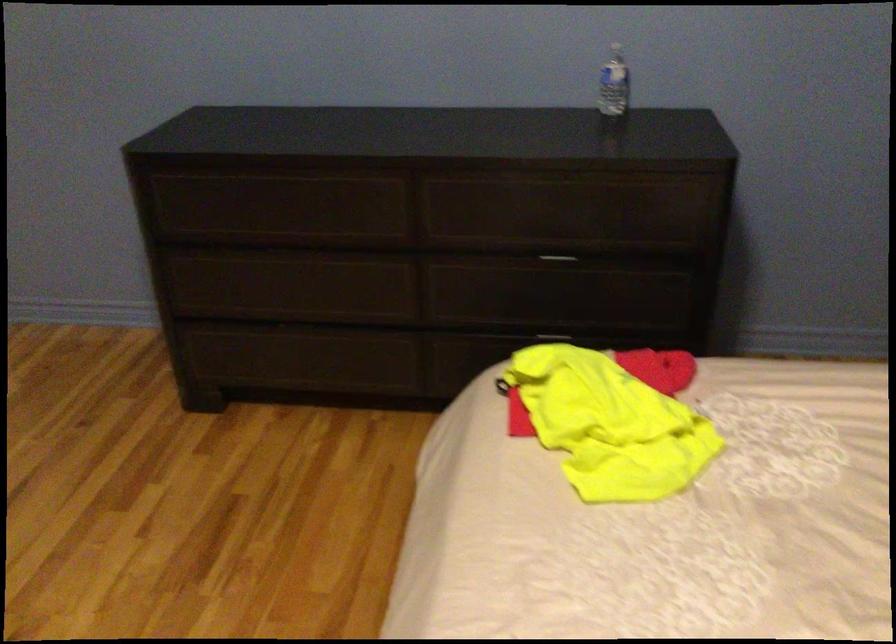
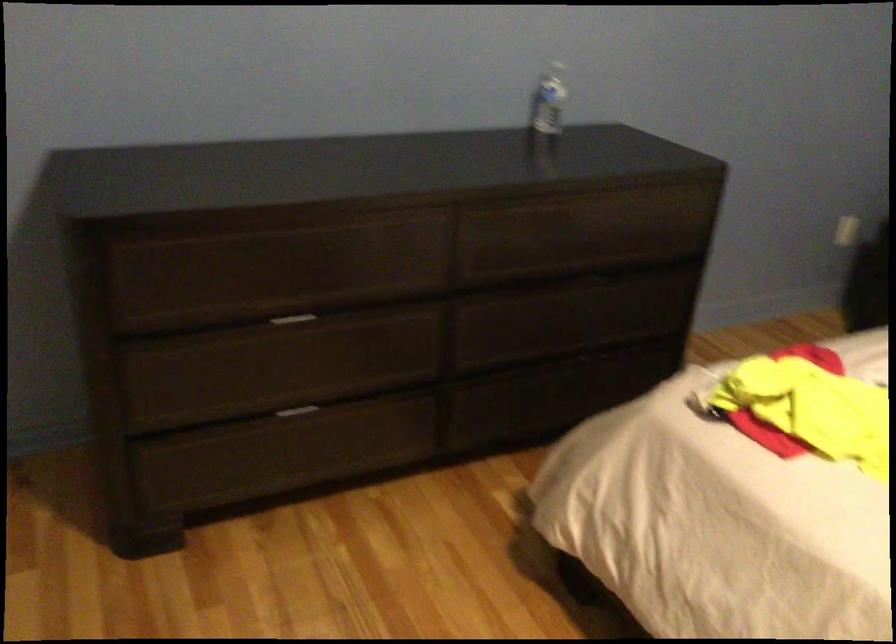
Locate, in the second image, the point that corresponds to (x=297, y=328) in the first image.

(297, 411)